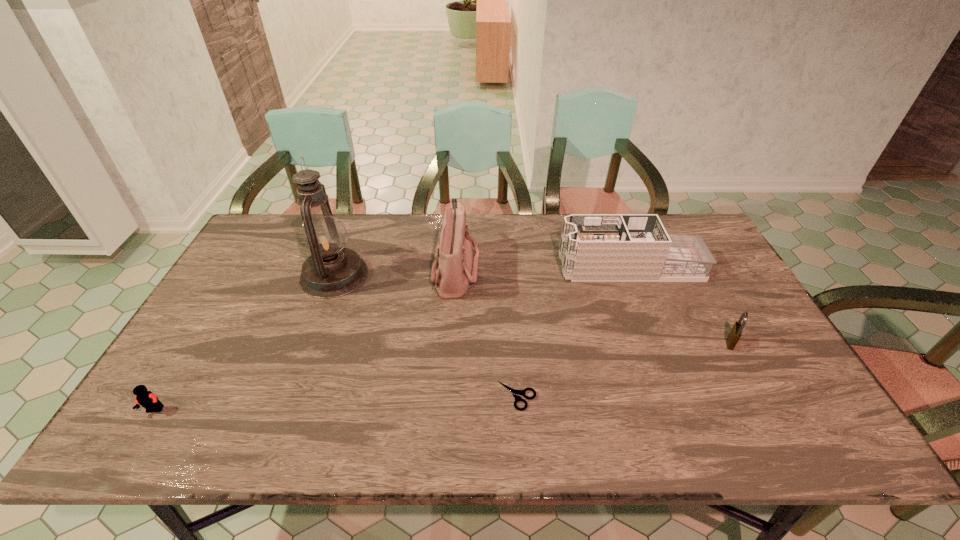
At what (x,y) coordinates should I click in order to perform the action: click on dollhouse at the far edge. Please return your answer as a coordinate pair (x, y). The width and height of the screenshot is (960, 540). Looking at the image, I should click on (594, 247).

The image size is (960, 540). What are the coordinates of `object located in the near edge section of the desktop` in the screenshot? It's located at pos(148,400).

This screenshot has height=540, width=960. Identify the location of object situated at the left edge. (148, 400).

Find the location of a particular element. The width and height of the screenshot is (960, 540). dollhouse at the right edge is located at coordinates (594, 247).

Where is `padlock that is positioned at the right edge`? padlock that is positioned at the right edge is located at coordinates (736, 331).

You are a GUI agent. You are given a task and a screenshot of the screen. Output one action in this format:
    pyautogui.click(x=<x>, y=<y>)
    Task: Click on the object positioned at the near left corner
    
    Given the screenshot: What is the action you would take?
    pyautogui.click(x=148, y=400)

The width and height of the screenshot is (960, 540). I want to click on object present at the far right corner, so click(x=594, y=247).

The image size is (960, 540). Identify the location of free space at the far edge of the desktop. (422, 248).

Where is `vacant area at the near edge of the desktop`? The image size is (960, 540). vacant area at the near edge of the desktop is located at coordinates (302, 443).

Locate an element on the screen. This screenshot has width=960, height=540. vacant area at the left edge of the desktop is located at coordinates (171, 404).